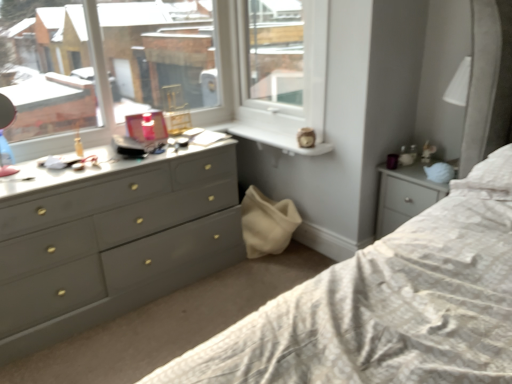
Question: Is white plastic window frame at upper center spatially inside matte gray dresser at left, or outside of it?

Choices:
 (A) outside
 (B) inside

Answer: (A)

Question: From a real-world perspective, relative to matte gray dresser at left, is white plastic window frame at upper center vertically above or below?

Choices:
 (A) below
 (B) above

Answer: (B)

Question: Looking at their shapes, would you say white plastic window frame at upper center is wider or thinner than matte gray dresser at left?

Choices:
 (A) wide
 (B) thin

Answer: (B)

Question: Relative to white plastic window frame at upper center, is matte gray dresser at left in front or behind?

Choices:
 (A) behind
 (B) front

Answer: (B)

Question: Is point tap(185, 198) closer or farther from the camera than point tap(272, 59)?

Choices:
 (A) farther
 (B) closer

Answer: (B)

Question: Considering the positions of matte gray dresser at left and white plastic window frame at upper center in the image, is matte gray dresser at left wider or thinner than white plastic window frame at upper center?

Choices:
 (A) wide
 (B) thin

Answer: (A)

Question: From a real-world perspective, relative to white plastic window frame at upper center, is matte gray dresser at left vertically above or below?

Choices:
 (A) above
 (B) below

Answer: (B)